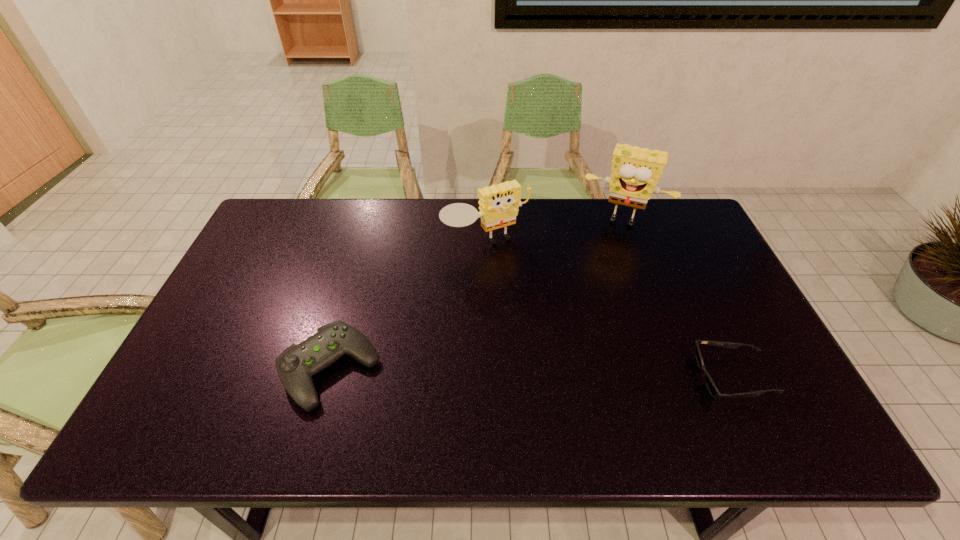
This screenshot has width=960, height=540. Find the location of `control`. control is located at coordinates (296, 365).

This screenshot has width=960, height=540. In order to click on the third tallest object in this screenshot , I will do `click(296, 365)`.

Where is `the shortest object`? The width and height of the screenshot is (960, 540). the shortest object is located at coordinates (711, 386).

In order to click on the second object from left to right in this screenshot , I will do `click(499, 204)`.

At what (x,y) coordinates should I click in order to perform the action: click on the second tallest object. Please return your answer as a coordinate pair (x, y). This screenshot has height=540, width=960. Looking at the image, I should click on (499, 204).

I want to click on the taller sponge, so click(635, 171).

Where is `the tallest object`? The image size is (960, 540). the tallest object is located at coordinates (635, 171).

Find the location of a particular element. free space located on the left of the control is located at coordinates (249, 369).

At what (x,y) coordinates should I click in order to perform the action: click on vacant space located on the front-facing side of the shortest object. Please return your answer as a coordinate pair (x, y). The image size is (960, 540). Looking at the image, I should click on (656, 377).

You are a GUI agent. You are given a task and a screenshot of the screen. Output one action in this format:
    pyautogui.click(x=<x>, y=<y>)
    Task: Click on the free space located on the front-facing side of the shortest object
    The image size is (960, 540).
    Given the screenshot: What is the action you would take?
    pyautogui.click(x=643, y=377)